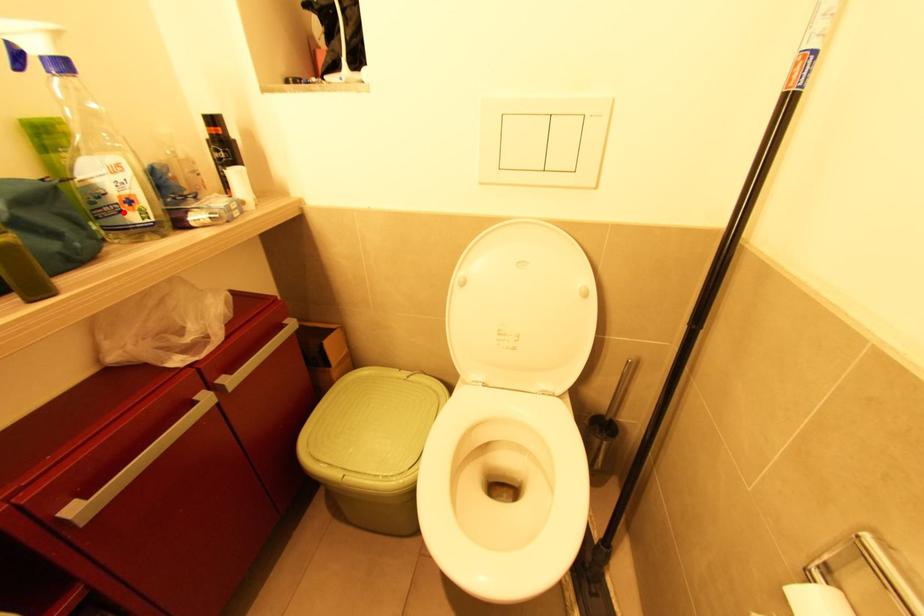
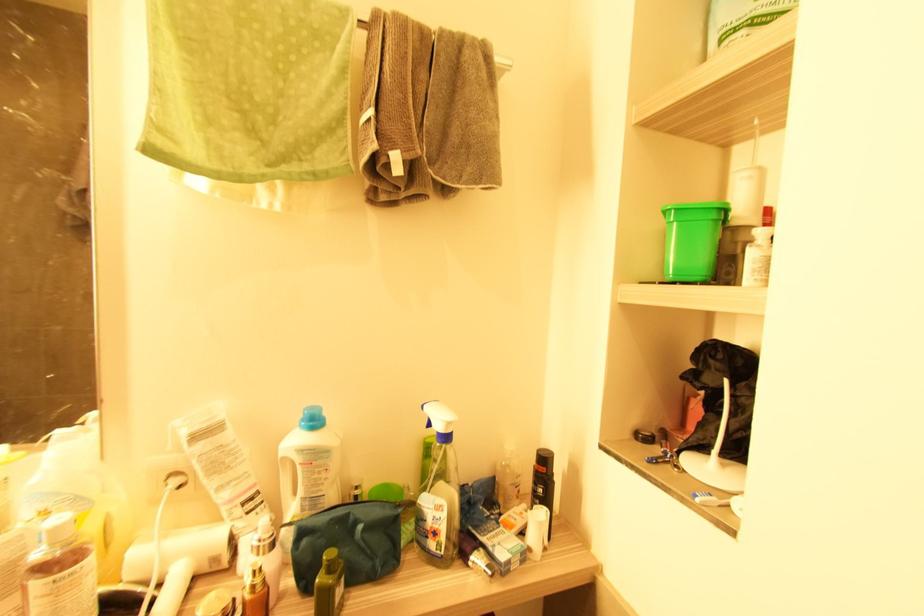
Find the pixel in the second image that matches the highlighted location in the first image.

(429, 539)